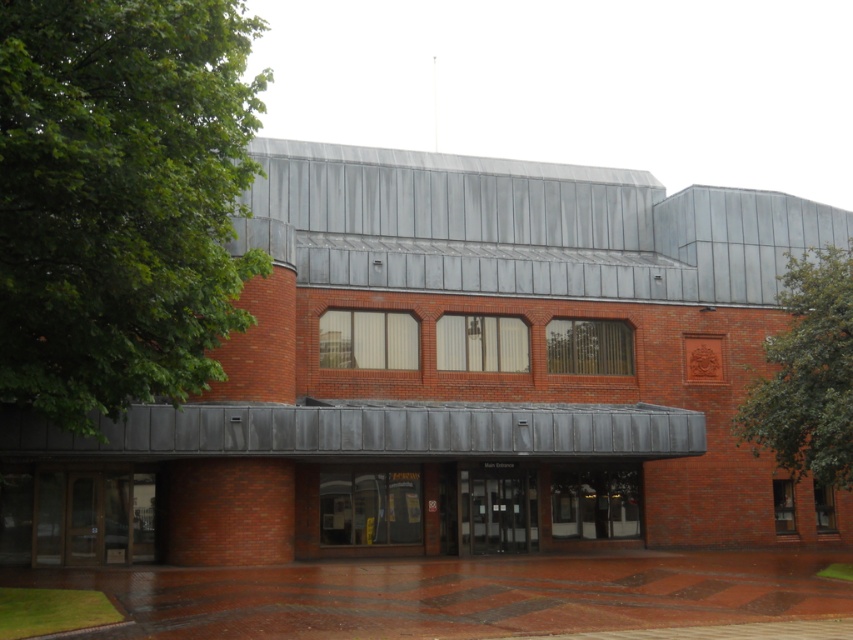
You are standing in front of the building and want to enter through the black glass doors at center. There is a green leafy tree at upper right blocking your view. Can you walk straight ahead to reach the doors without moving around the tree?

The green leafy tree at upper right is further to the viewer than black glass doors at center, meaning the tree is closer to you. Since the tree is in front of you, walking straight ahead would require moving around it to reach the black glass doors at center.

You are standing at the entrance of the modern building and see two points marked on the wall. The first point is at coordinates point (753, 451) and the second is at point (489, 538). Which point is closer to you as you face the building?

Point (753, 451) is in front of point (489, 538), so the first point is closer to you when facing the building.